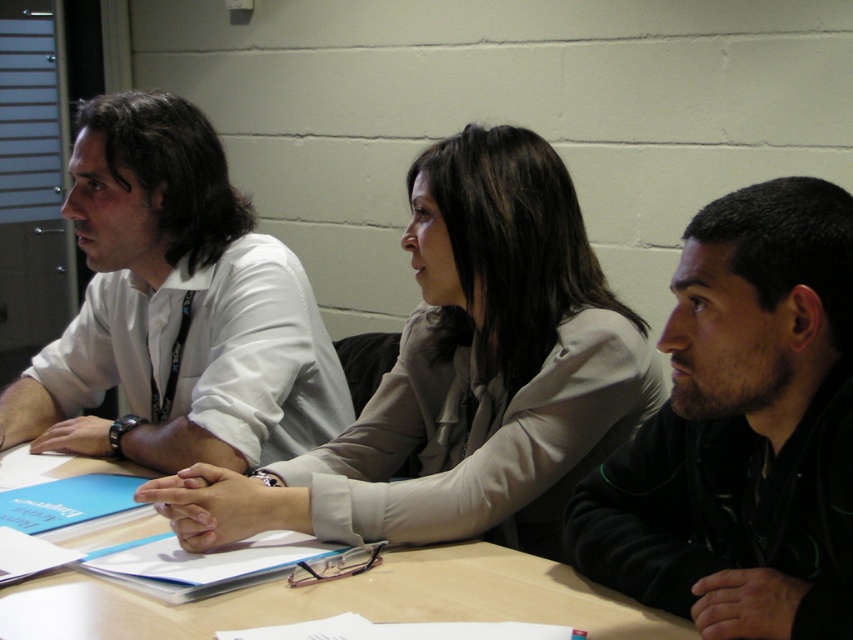
Question: Considering the real-world distances, which object is farthest from the dark brown hair at center?

Choices:
 (A) white shirt at center
 (B) wooden table at center

Answer: (A)

Question: Estimate the real-world distances between objects in this image. Which object is closer to the light beige fabric jacket at center?

Choices:
 (A) white shirt at center
 (B) dark brown hair at center

Answer: (B)

Question: Can you confirm if light beige fabric jacket at center is positioned to the left of white shirt at center?

Choices:
 (A) no
 (B) yes

Answer: (A)

Question: From the image, what is the correct spatial relationship of light beige fabric jacket at center in relation to white shirt at center?

Choices:
 (A) left
 (B) right

Answer: (B)

Question: Observing the image, what is the correct spatial positioning of dark brown hair at center in reference to white shirt at center?

Choices:
 (A) above
 (B) below

Answer: (B)

Question: Which point is farther to the camera?

Choices:
 (A) light beige fabric jacket at center
 (B) white shirt at center

Answer: (B)